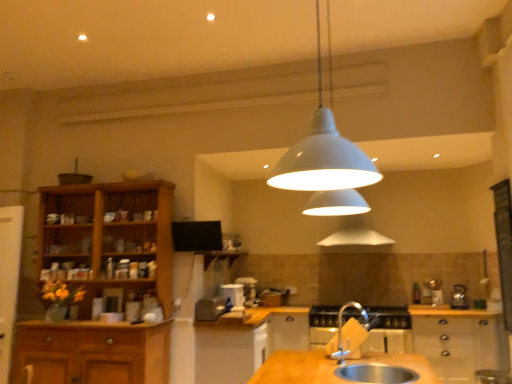
Question: Is white glossy coffee cup at center, which ranks as the 2th appliance in right-to-left order, next to white matte pendant light at center and touching it?

Choices:
 (A) yes
 (B) no

Answer: (B)

Question: From a real-world perspective, is white glossy coffee cup at center, which ranks as the 2th appliance in right-to-left order, beneath white matte pendant light at center?

Choices:
 (A) no
 (B) yes

Answer: (B)

Question: Is white glossy coffee cup at center, placed as the 3th appliance when sorted from left to right, at the left side of white matte pendant light at center?

Choices:
 (A) no
 (B) yes

Answer: (B)

Question: Considering the relative positions of white glossy coffee cup at center, which ranks as the 2th appliance in right-to-left order, and white matte pendant light at center in the image provided, is white glossy coffee cup at center, which ranks as the 2th appliance in right-to-left order, to the right of white matte pendant light at center from the viewer's perspective?

Choices:
 (A) yes
 (B) no

Answer: (B)

Question: Would you consider white glossy coffee cup at center, placed as the 3th appliance when sorted from left to right, to be distant from white matte pendant light at center?

Choices:
 (A) no
 (B) yes

Answer: (B)

Question: From a real-world perspective, is wooden cabinet at center, the second cabinetry when ordered from right to left, positioned above or below white glossy cabinet at left, the 4th appliance from the right?

Choices:
 (A) above
 (B) below

Answer: (B)

Question: Considering the relative positions of wooden cabinet at center, the second cabinetry when ordered from right to left, and white glossy cabinet at left, which is the 1th appliance in left-to-right order, in the image provided, is wooden cabinet at center, the second cabinetry when ordered from right to left, to the left or to the right of white glossy cabinet at left, which is the 1th appliance in left-to-right order,?

Choices:
 (A) right
 (B) left

Answer: (A)

Question: Considering the positions of point (x=287, y=347) and point (x=12, y=306), is point (x=287, y=347) closer or farther from the camera than point (x=12, y=306)?

Choices:
 (A) closer
 (B) farther

Answer: (B)

Question: In terms of width, does wooden cabinet at center, positioned as the second cabinetry in left-to-right order, look wider or thinner when compared to white glossy cabinet at left, which is the 1th appliance in left-to-right order?

Choices:
 (A) wide
 (B) thin

Answer: (A)

Question: Is white matte pendant light at center inside the boundaries of silver metallic sink at lower center, or outside?

Choices:
 (A) inside
 (B) outside

Answer: (B)

Question: Relative to silver metallic sink at lower center, is white matte pendant light at center in front or behind?

Choices:
 (A) behind
 (B) front

Answer: (B)

Question: Is white matte pendant light at center wider or thinner than silver metallic sink at lower center?

Choices:
 (A) wide
 (B) thin

Answer: (B)

Question: Based on their sizes in the image, would you say white matte pendant light at center is bigger or smaller than silver metallic sink at lower center?

Choices:
 (A) big
 (B) small

Answer: (A)

Question: Is silver metallic sink at lower center in front of or behind white glossy cabinet at lower right, marked as the 1th cabinetry in a right-to-left arrangement, in the image?

Choices:
 (A) front
 (B) behind

Answer: (A)

Question: Is silver metallic sink at lower center taller or shorter than white glossy cabinet at lower right, which is counted as the third cabinetry, starting from the left?

Choices:
 (A) short
 (B) tall

Answer: (A)